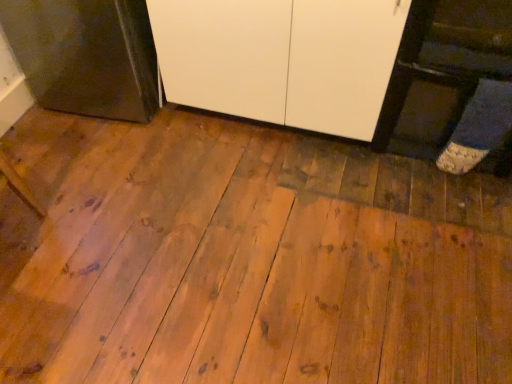
Where is `vacant region in front of metallic dark gray oven at left`? This screenshot has width=512, height=384. vacant region in front of metallic dark gray oven at left is located at coordinates (106, 161).